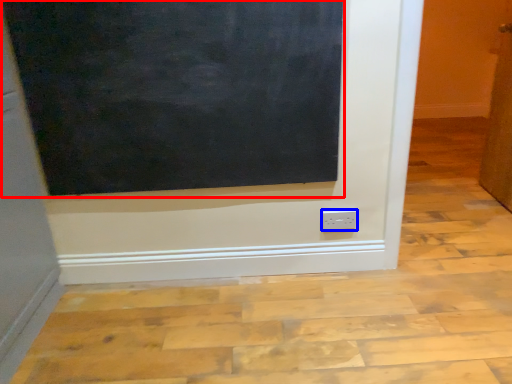
Question: Which of the following is the closest to the observer, bulletin board (highlighted by a red box) or power plugs and sockets (highlighted by a blue box)?

Choices:
 (A) bulletin board
 (B) power plugs and sockets

Answer: (A)